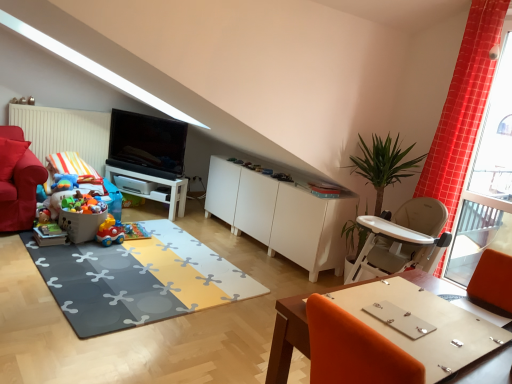
This screenshot has height=384, width=512. I want to click on free space in front of plastic matte car at center, which is counted as the third toy, starting from the top, so click(103, 246).